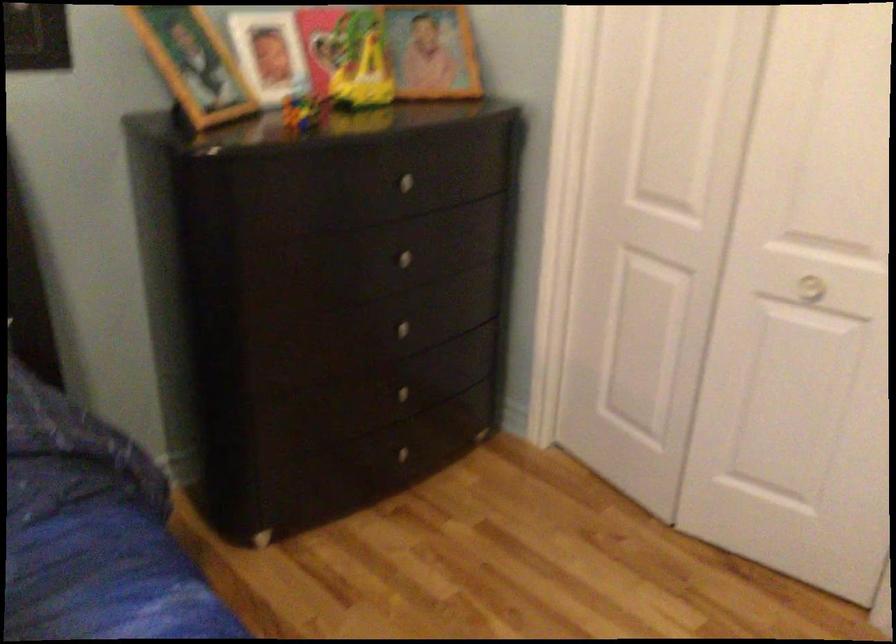
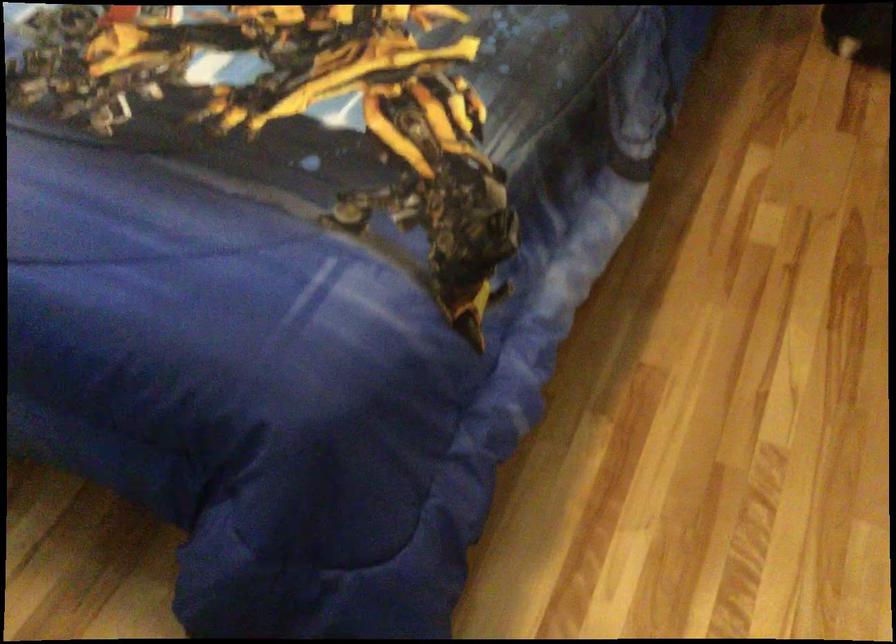
How did the camera likely rotate?

The camera's rotation is toward left-down.